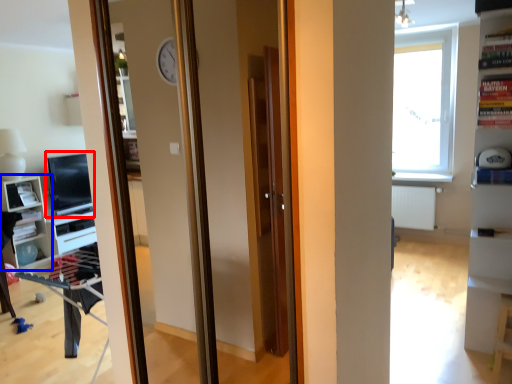
Question: Which object appears farthest to the camera in this image, computer monitor (highlighted by a red box) or shelf (highlighted by a blue box)?

Choices:
 (A) computer monitor
 (B) shelf

Answer: (A)